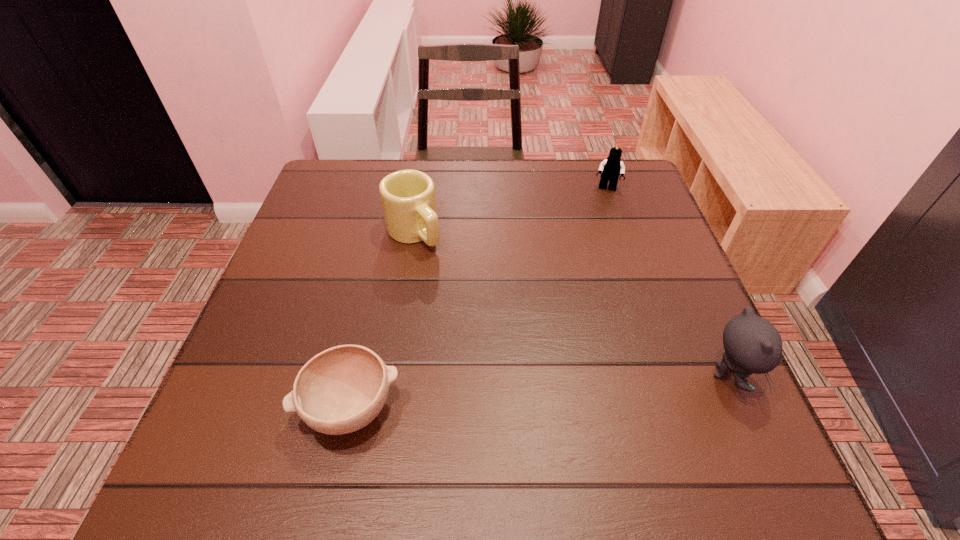
Locate an element on the screen. The image size is (960, 540). vacant space on the desktop that is between the bowl and the kitten and is positioned on the front-facing side of the farthest object is located at coordinates (587, 387).

This screenshot has width=960, height=540. Find the location of `free space on the desktop that is between the bowl and the rightmost object and is positioned with the handle on the side of the second farthest object`. free space on the desktop that is between the bowl and the rightmost object and is positioned with the handle on the side of the second farthest object is located at coordinates (562, 389).